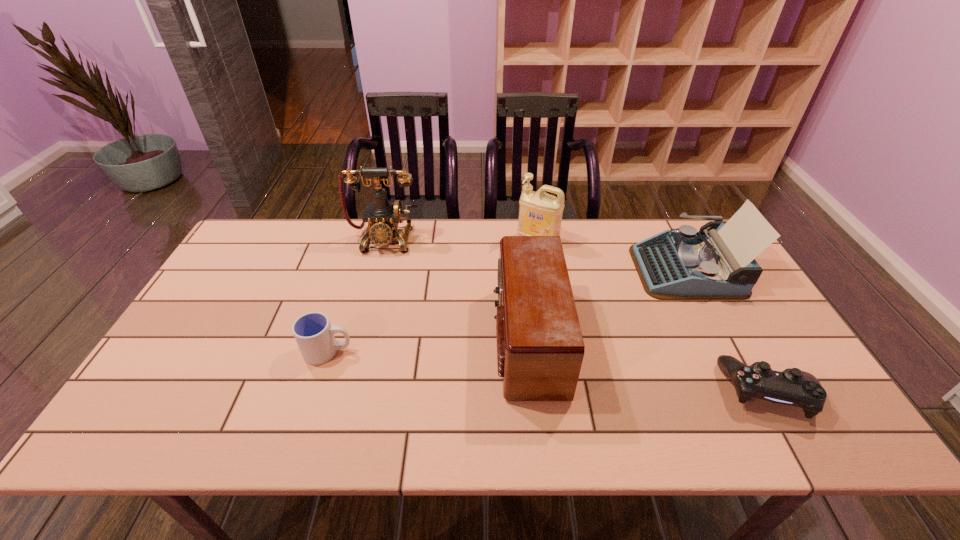
Where is `vacant area situated 0.270m on the typing side of the typewriter`? vacant area situated 0.270m on the typing side of the typewriter is located at coordinates (549, 269).

Image resolution: width=960 pixels, height=540 pixels. What are the coordinates of `free location located 0.400m on the front-facing side of the radio receiver` in the screenshot? It's located at (342, 339).

Find the location of a particular element. vacant space located on the front-facing side of the radio receiver is located at coordinates (475, 339).

You are a GUI agent. You are given a task and a screenshot of the screen. Output one action in this format:
    pyautogui.click(x=<x>, y=<y>)
    Task: Click on the vacant space situated on the front-facing side of the radio receiver
    This screenshot has height=540, width=960.
    Given the screenshot: What is the action you would take?
    pyautogui.click(x=346, y=339)

You are a GUI agent. You are given a task and a screenshot of the screen. Output one action in this format:
    pyautogui.click(x=<x>, y=<y>)
    Task: Click on the free point located 0.210m with the handle on the side of the cup
    
    Given the screenshot: What is the action you would take?
    435,352

Where is `free space located on the back of the control`? This screenshot has width=960, height=540. free space located on the back of the control is located at coordinates (734, 331).

The width and height of the screenshot is (960, 540). What are the coordinates of `telephone at the far edge` in the screenshot? It's located at (383, 217).

What are the coordinates of `detergent that is at the far edge` in the screenshot? It's located at pyautogui.click(x=540, y=214).

Locate an element on the screen. The height and width of the screenshot is (540, 960). typewriter situated at the far edge is located at coordinates (717, 263).

You are a GUI agent. You are given a task and a screenshot of the screen. Output one action in this format:
    pyautogui.click(x=<x>, y=<y>)
    Task: Click on the object that is positioned at the near edge
    
    Given the screenshot: What is the action you would take?
    pyautogui.click(x=793, y=387)